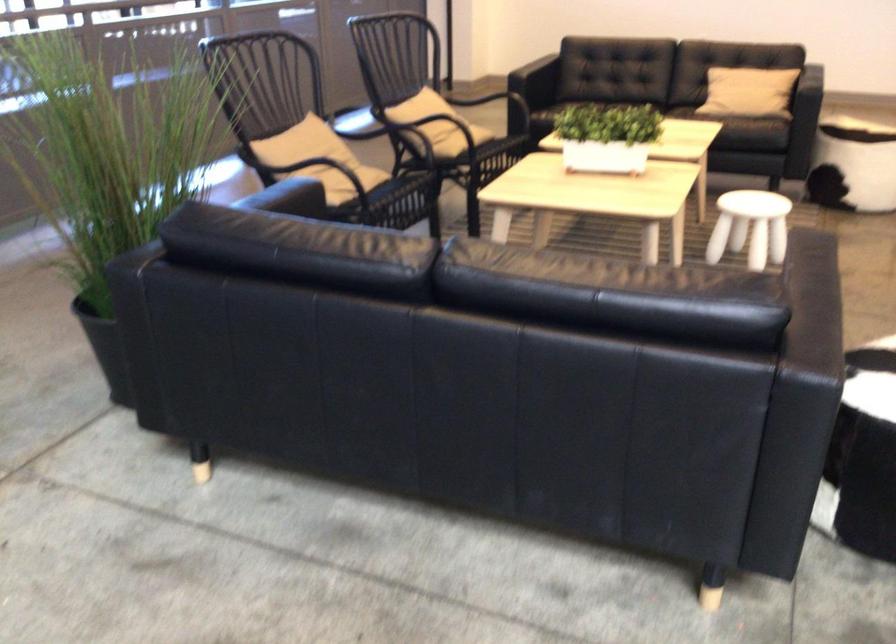
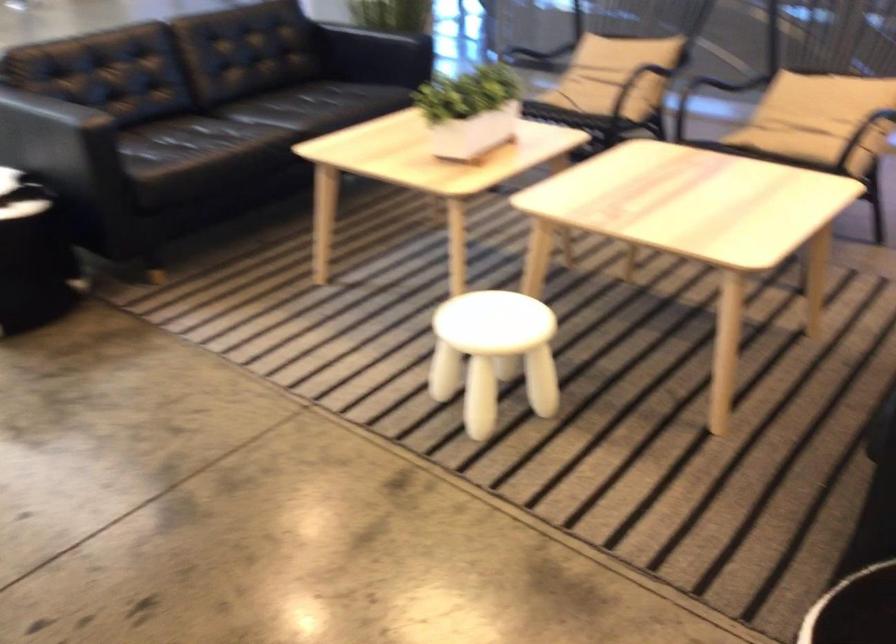
Locate, in the second image, the point that corresponds to the point at 625,129 in the first image.

(470, 111)